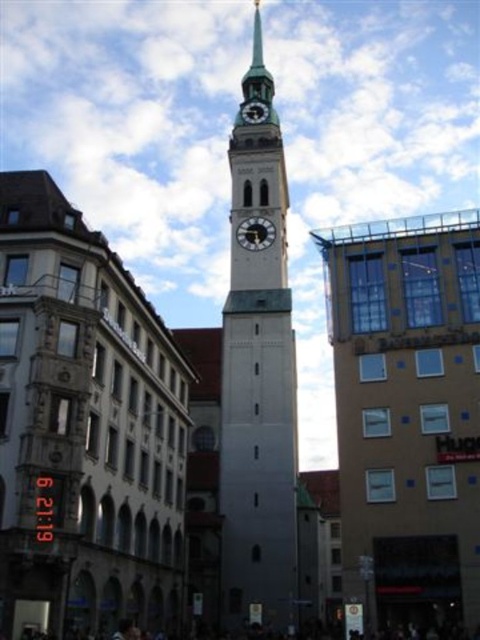
Does point (254, 518) come behind point (252, 113)?

No, it is not.

Is white stone clock tower at center above metallic clock tower at center?

Actually, white stone clock tower at center is below metallic clock tower at center.

What do you see at coordinates (257, 378) in the screenshot? I see `white stone clock tower at center` at bounding box center [257, 378].

The height and width of the screenshot is (640, 480). What are the coordinates of `white stone clock tower at center` in the screenshot? It's located at (257, 378).

Can you confirm if metallic clock face at center is shorter than metallic clock tower at center?

In fact, metallic clock face at center may be taller than metallic clock tower at center.

Describe the element at coordinates (255, 234) in the screenshot. I see `metallic clock face at center` at that location.

Between point (274, 240) and point (252, 113), which one is positioned behind?

Positioned behind is point (252, 113).

You are a GUI agent. You are given a task and a screenshot of the screen. Output one action in this format:
    pyautogui.click(x=<x>, y=<y>)
    Task: Click on the metallic clock face at center
    
    Given the screenshot: What is the action you would take?
    pyautogui.click(x=255, y=234)

Who is more distant from viewer, [255,436] or [260,243]?

The point [260,243] is behind.

Who is more distant from viewer, [292,408] or [243,228]?

Point [243,228]

Locate an element on the screen. The width and height of the screenshot is (480, 640). white stone clock tower at center is located at coordinates (257, 378).